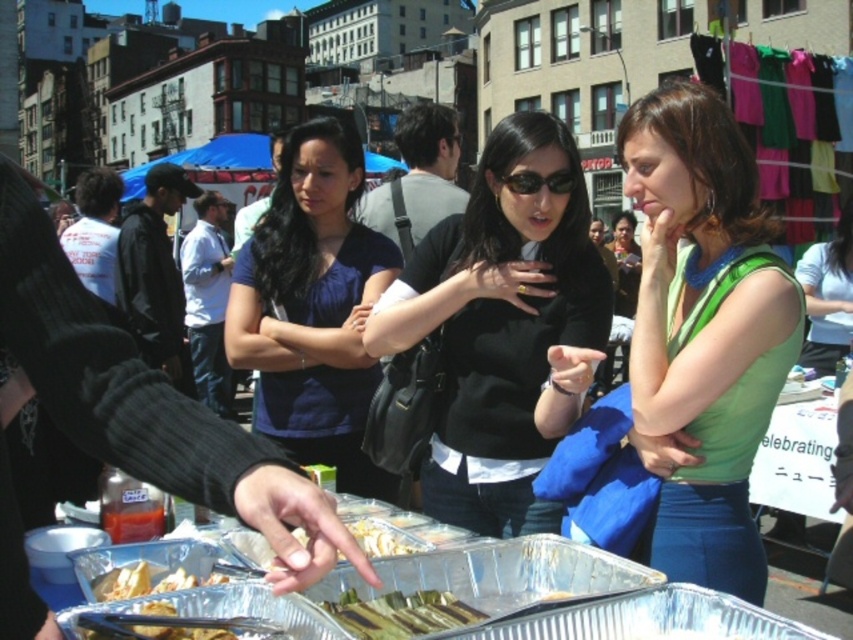
Does point (440, 596) lie behind point (518, 188)?

No, it is in front of (518, 188).

Which is more to the left, shiny metallic skewers at center or sunglasses at center?

shiny metallic skewers at center

Is point (380, 609) farther from viewer compared to point (525, 173)?

That is False.

Locate an element on the screen. The image size is (853, 640). shiny metallic skewers at center is located at coordinates (401, 612).

Which of these two, green matte tank top at center or green fabric shirt at center, stands shorter?

With less height is green fabric shirt at center.

Can you confirm if green matte tank top at center is taller than green fabric shirt at center?

Yes, green matte tank top at center is taller than green fabric shirt at center.

Is point (740, 204) positioned in front of point (817, 307)?

Yes, it is.

Where is `green matte tank top at center`? The height and width of the screenshot is (640, 853). green matte tank top at center is located at coordinates (703, 333).

Can you confirm if green fabric shirt at center is positioned below white glossy tortilla at center?

No.

How much distance is there between green fabric shirt at center and white glossy tortilla at center?

90.44 feet

Between point (825, 266) and point (381, 536), which one is positioned in front?

Point (381, 536) is in front.

The image size is (853, 640). I want to click on green fabric shirt at center, so 828,296.